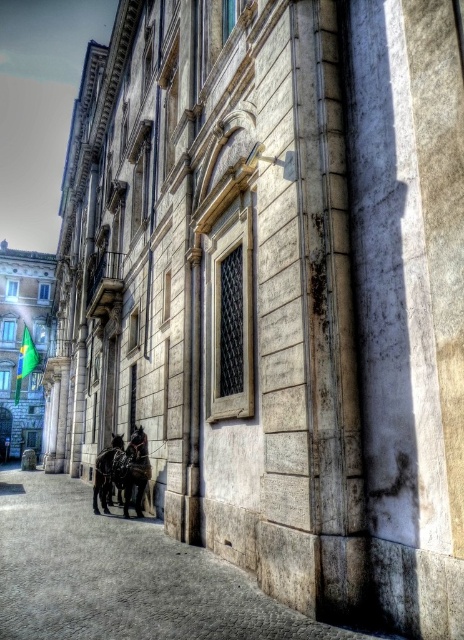
Does stone textured alley at lower left appear on the right side of shiny black horse at lower left?

In fact, stone textured alley at lower left is to the left of shiny black horse at lower left.

Is stone textured alley at lower left closer to camera compared to shiny black horse at lower left?

Yes, it is in front of shiny black horse at lower left.

Who is more distant from viewer, [133,628] or [109,490]?

→ Point [109,490]

Where is `stone textured alley at lower left`? stone textured alley at lower left is located at coordinates (122, 577).

Is shiny black horse at center thinner than shiny black horse at lower left?

Yes, shiny black horse at center is thinner than shiny black horse at lower left.

Is shiny black horse at center wider than shiny black horse at lower left?

No, shiny black horse at center is not wider than shiny black horse at lower left.

Who is more forward, (128, 449) or (109, 452)?

Positioned in front is point (128, 449).

The image size is (464, 640). I want to click on shiny black horse at center, so click(x=135, y=470).

Who is lower down, stone textured alley at lower left or shiny black horse at center?

stone textured alley at lower left is lower down.

Between point (133, 550) and point (122, 483), which one is positioned behind?

Point (122, 483)

Describe the element at coordinates (122, 577) in the screenshot. The width and height of the screenshot is (464, 640). I see `stone textured alley at lower left` at that location.

I want to click on stone textured alley at lower left, so click(122, 577).